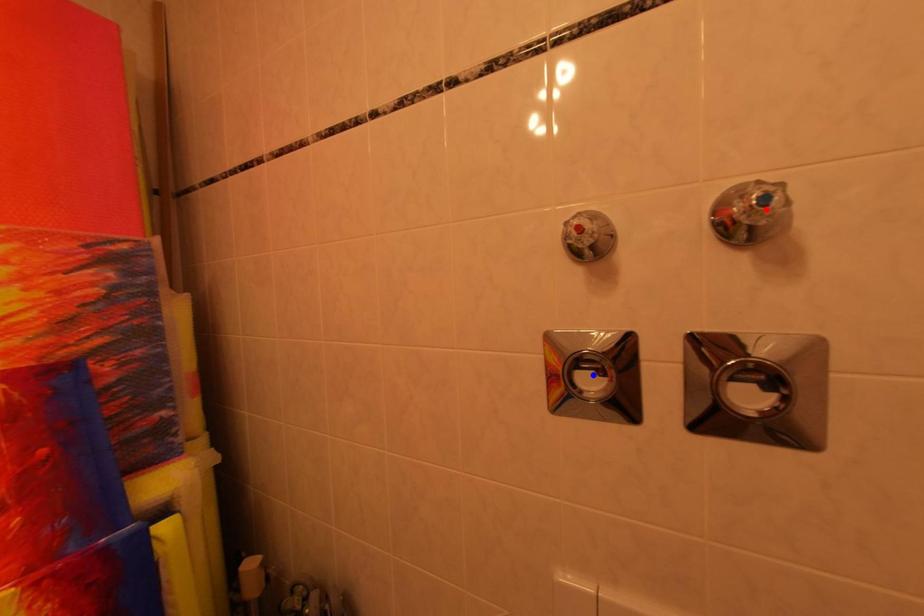
Question: Two points are marked on the image. Which point is closer to the camera?

Choices:
 (A) Blue point is closer.
 (B) Red point is closer.

Answer: (B)